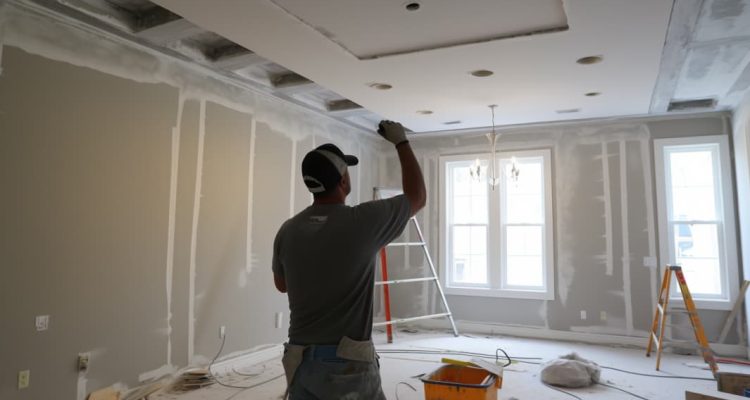
Find the location of a particular element. The width and height of the screenshot is (750, 400). outlet is located at coordinates (x=580, y=312), (x=600, y=318), (x=22, y=371).